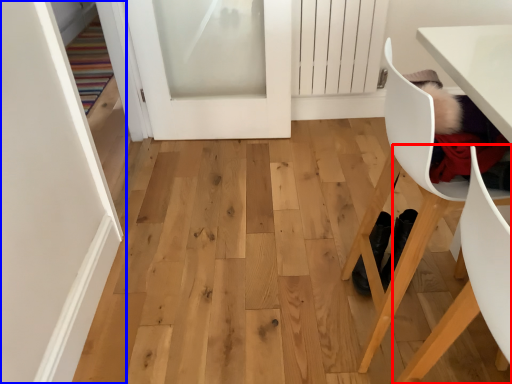
Question: Which of the following is the farthest to the observer, chair (highlighted by a red box) or door (highlighted by a blue box)?

Choices:
 (A) chair
 (B) door

Answer: (B)